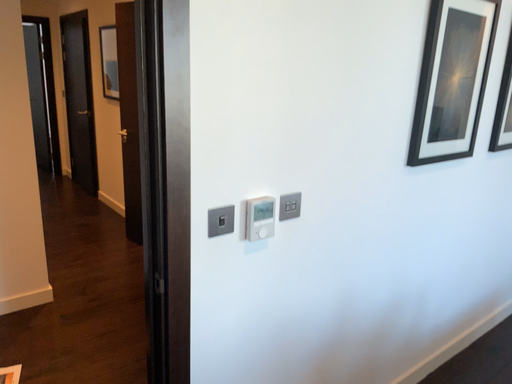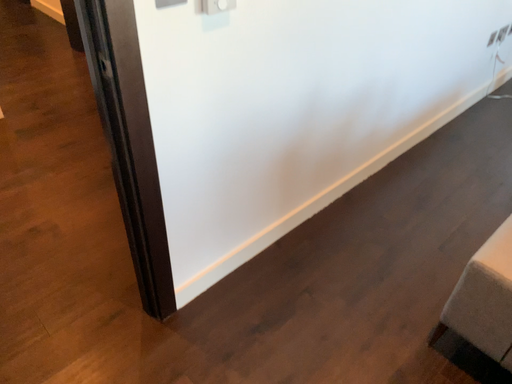
Question: How did the camera likely rotate when shooting the video?

Choices:
 (A) rotated upward
 (B) rotated downward

Answer: (B)